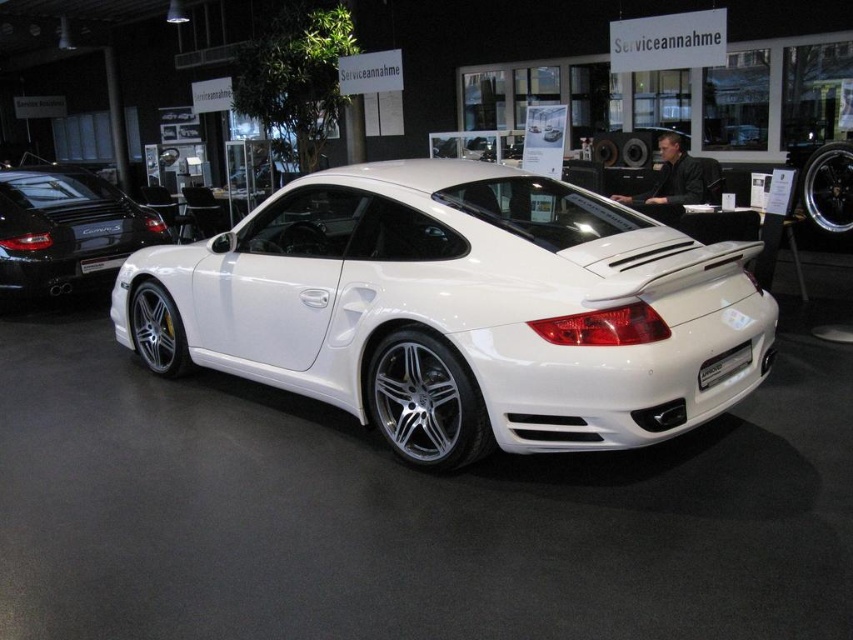
Is white metallic license plate at rear thinner than white glossy license plate at center?

In fact, white metallic license plate at rear might be wider than white glossy license plate at center.

Which is more to the left, white metallic license plate at rear or white glossy license plate at center?

white glossy license plate at center

Image resolution: width=853 pixels, height=640 pixels. What are the coordinates of `white metallic license plate at rear` in the screenshot? It's located at (724, 365).

Is the position of white glossy sports car at center less distant than that of white glossy license plate at center?

Yes, white glossy sports car at center is closer to the viewer.

Is white glossy sports car at center smaller than white glossy license plate at center?

Actually, white glossy sports car at center might be larger than white glossy license plate at center.

Is point (409, 394) positioned before point (103, 260)?

Yes, point (409, 394) is closer to viewer.

Identify the location of white glossy sports car at center. (457, 308).

Looking at this image, is white metallic car at center to the left of white matte porsche at center from the viewer's perspective?

Indeed, white metallic car at center is positioned on the left side of white matte porsche at center.

Can you confirm if white metallic car at center is shorter than white matte porsche at center?

Incorrect, white metallic car at center's height does not fall short of white matte porsche at center's.

The image size is (853, 640). In order to click on white metallic car at center in this screenshot , I will do `click(65, 228)`.